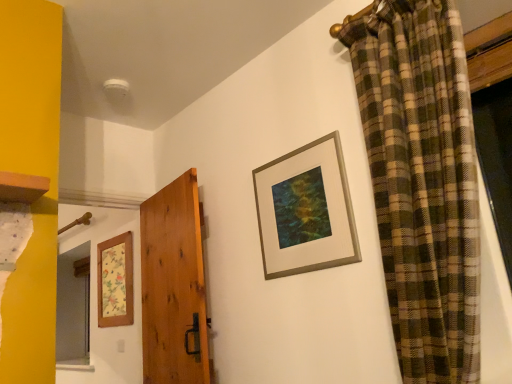
Question: Is the depth of natural wood door at center less than that of wooden floral-patterned picture frame at left, the 1th picture frame positioned from the bottom?

Choices:
 (A) yes
 (B) no

Answer: (A)

Question: Considering the relative sizes of natural wood door at center and wooden floral-patterned picture frame at left, the 1th picture frame positioned from the back, in the image provided, is natural wood door at center thinner than wooden floral-patterned picture frame at left, the 1th picture frame positioned from the back,?

Choices:
 (A) yes
 (B) no

Answer: (B)

Question: Is natural wood door at center bigger than wooden floral-patterned picture frame at left, which is the second picture frame in right-to-left order?

Choices:
 (A) yes
 (B) no

Answer: (A)

Question: From a real-world perspective, is natural wood door at center under wooden floral-patterned picture frame at left, the second picture frame in the front-to-back sequence?

Choices:
 (A) no
 (B) yes

Answer: (B)

Question: Is natural wood door at center at the right side of wooden floral-patterned picture frame at left, which ranks as the second picture frame in top-to-bottom order?

Choices:
 (A) no
 (B) yes

Answer: (B)

Question: From a real-world perspective, relative to natural wood door at center, is wooden floral-patterned picture frame at left, which ranks as the second picture frame in top-to-bottom order, vertically above or below?

Choices:
 (A) below
 (B) above

Answer: (B)

Question: Is wooden floral-patterned picture frame at left, the 1th picture frame positioned from the left, taller or shorter than natural wood door at center?

Choices:
 (A) short
 (B) tall

Answer: (A)

Question: In terms of size, does wooden floral-patterned picture frame at left, the 1th picture frame positioned from the bottom, appear bigger or smaller than natural wood door at center?

Choices:
 (A) big
 (B) small

Answer: (B)

Question: From the image's perspective, is wooden floral-patterned picture frame at left, which ranks as the second picture frame in top-to-bottom order, positioned above or below natural wood door at center?

Choices:
 (A) above
 (B) below

Answer: (B)

Question: Considering the positions of natural wood door at center and gold metallic picture frame at upper center, the 2th picture frame from the left, in the image, is natural wood door at center bigger or smaller than gold metallic picture frame at upper center, the 2th picture frame from the left,?

Choices:
 (A) big
 (B) small

Answer: (A)

Question: From a real-world perspective, is natural wood door at center positioned above or below gold metallic picture frame at upper center, marked as the 1th picture frame in a right-to-left arrangement?

Choices:
 (A) above
 (B) below

Answer: (B)

Question: Is natural wood door at center wider or thinner than gold metallic picture frame at upper center, which is the 1th picture frame from top to bottom?

Choices:
 (A) thin
 (B) wide

Answer: (B)

Question: Is natural wood door at center inside the boundaries of gold metallic picture frame at upper center, marked as the 1th picture frame in a right-to-left arrangement, or outside?

Choices:
 (A) inside
 (B) outside

Answer: (B)

Question: Considering the positions of gold metallic picture frame at upper center, marked as the 1th picture frame in a right-to-left arrangement, and wooden floral-patterned picture frame at left, which is the second picture frame in right-to-left order, in the image, is gold metallic picture frame at upper center, marked as the 1th picture frame in a right-to-left arrangement, bigger or smaller than wooden floral-patterned picture frame at left, which is the second picture frame in right-to-left order,?

Choices:
 (A) small
 (B) big

Answer: (A)

Question: Considering the relative positions of gold metallic picture frame at upper center, marked as the 1th picture frame in a right-to-left arrangement, and wooden floral-patterned picture frame at left, which is the second picture frame in right-to-left order, in the image provided, is gold metallic picture frame at upper center, marked as the 1th picture frame in a right-to-left arrangement, to the left or to the right of wooden floral-patterned picture frame at left, which is the second picture frame in right-to-left order,?

Choices:
 (A) right
 (B) left

Answer: (A)